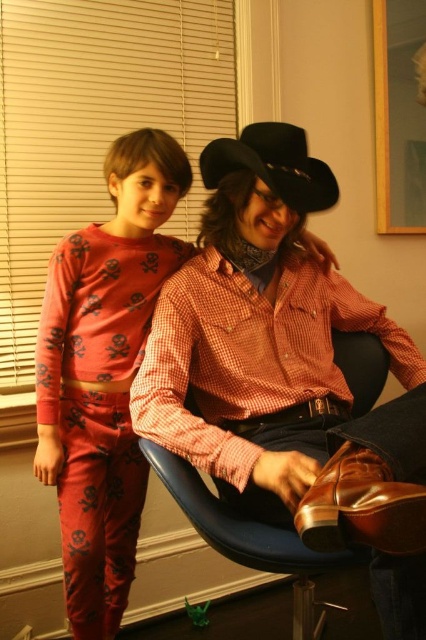
Does blue plastic swivel chair at center appear on the right side of black felt fedora at upper center?

Indeed, blue plastic swivel chair at center is positioned on the right side of black felt fedora at upper center.

Looking at this image, which is below, blue plastic swivel chair at center or black felt fedora at upper center?

blue plastic swivel chair at center is below.

Locate an element on the screen. Image resolution: width=426 pixels, height=640 pixels. blue plastic swivel chair at center is located at coordinates (247, 529).

Is matte red pajamas at left closer to the viewer compared to blue plastic swivel chair at center?

No, it is behind blue plastic swivel chair at center.

Where is `matte red pajamas at left`? matte red pajamas at left is located at coordinates [103, 372].

Locate an element on the screen. The height and width of the screenshot is (640, 426). matte red pajamas at left is located at coordinates (103, 372).

Can you confirm if matte red pajamas at left is taller than black felt fedora at upper center?

Yes, matte red pajamas at left is taller than black felt fedora at upper center.

The image size is (426, 640). Describe the element at coordinates (103, 372) in the screenshot. I see `matte red pajamas at left` at that location.

Who is more forward, (69, 452) or (321, 211)?

Point (321, 211) is more forward.

Identify the location of matte red pajamas at left. The image size is (426, 640). (103, 372).